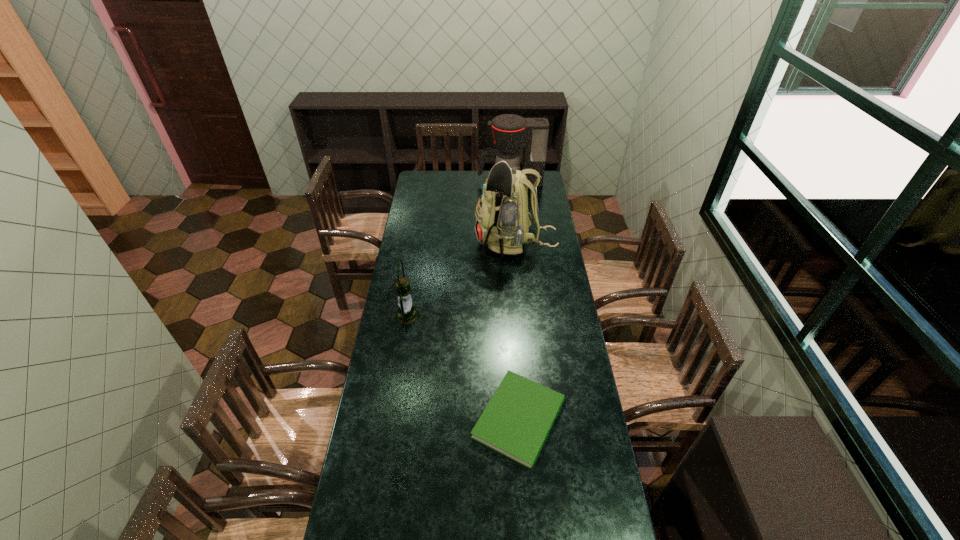
The width and height of the screenshot is (960, 540). What are the coordinates of `vacant space that satisfies the following two spatial constraints: 1. on the side where the leftmost object emits light; 2. on the back side of the shortest object` in the screenshot? It's located at (391, 419).

Find the location of a particular element. vacant area that satisfies the following two spatial constraints: 1. on the side where the nearest object emits light; 2. on the left side of the lantern is located at coordinates (391, 419).